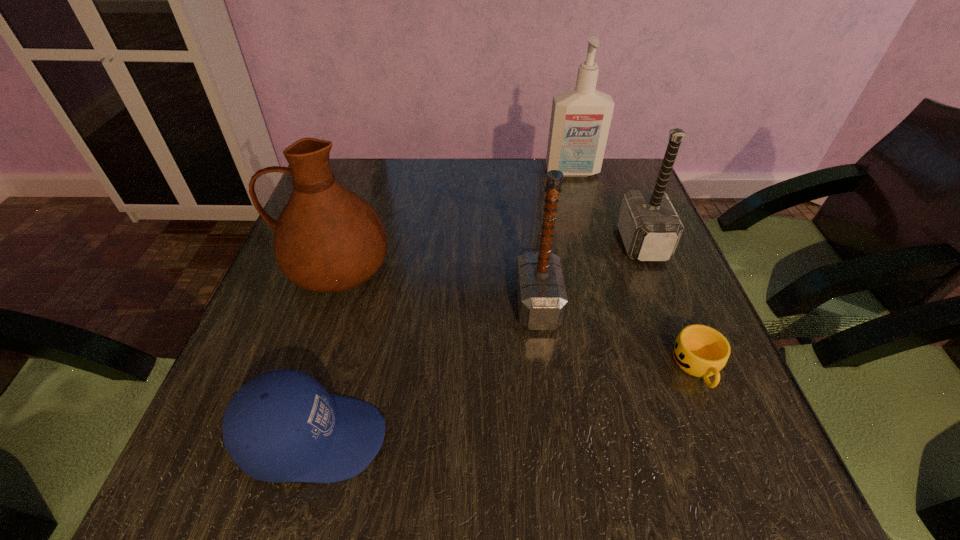
I want to click on free space located 0.290m on the striking surface of the left hammer, so [x=374, y=305].

Locate an element on the screen. The image size is (960, 540). vacant area situated 0.400m on the striking surface of the left hammer is located at coordinates (321, 305).

Where is `free location located 0.360m on the striking surface of the left hammer`? This screenshot has height=540, width=960. free location located 0.360m on the striking surface of the left hammer is located at coordinates (340, 305).

Identify the location of vacant area situated for striking with the head of the farther hammer. Image resolution: width=960 pixels, height=540 pixels. (595, 243).

Where is `vacant region located 0.170m for striking with the head of the farther hammer`? The height and width of the screenshot is (540, 960). vacant region located 0.170m for striking with the head of the farther hammer is located at coordinates (548, 243).

Image resolution: width=960 pixels, height=540 pixels. In order to click on free region located for striking with the head of the farther hammer in this screenshot , I will do `click(543, 243)`.

At what (x,y) coordinates should I click in order to perform the action: click on vacant space positioned on the front-facing side of the cap. Please return your answer as a coordinate pair (x, y). The image size is (960, 540). Looking at the image, I should click on (538, 438).

The image size is (960, 540). I want to click on vacant position located on the back of the fifth farthest object, so click(x=665, y=287).

Locate an element on the screen. This screenshot has width=960, height=540. object present at the far edge is located at coordinates (580, 121).

I want to click on object at the near edge, so click(x=282, y=426).